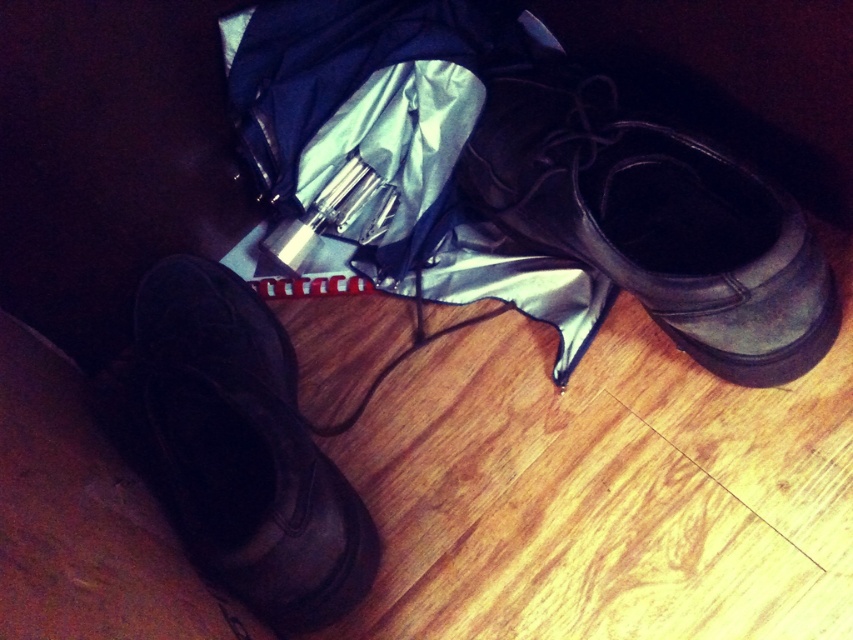
Question: Considering the real-world distances, which object is farthest from the matte black boot at lower left?

Choices:
 (A) leather boot at center
 (B) silvery fabric umbrella at center

Answer: (A)

Question: Which of these objects is positioned farthest from the matte black boot at lower left?

Choices:
 (A) leather boot at center
 (B) silvery fabric umbrella at center

Answer: (A)

Question: Is leather boot at center smaller than matte black boot at lower left?

Choices:
 (A) yes
 (B) no

Answer: (B)

Question: Estimate the real-world distances between objects in this image. Which object is closer to the matte black boot at lower left?

Choices:
 (A) leather boot at center
 (B) silvery fabric umbrella at center

Answer: (B)

Question: Is silvery fabric umbrella at center to the left of leather boot at center from the viewer's perspective?

Choices:
 (A) yes
 (B) no

Answer: (A)

Question: Is leather boot at center to the right of matte black boot at lower left from the viewer's perspective?

Choices:
 (A) no
 (B) yes

Answer: (B)